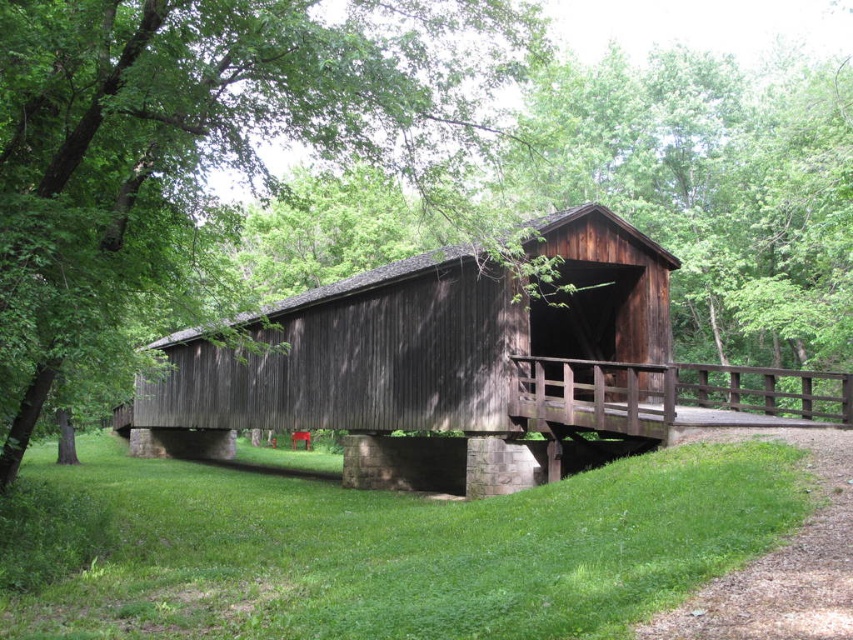
Question: Does green wood tree at center have a lesser width compared to green grass at lower right?

Choices:
 (A) yes
 (B) no

Answer: (B)

Question: Which point is closer to the camera?

Choices:
 (A) dark brown wooden bridge at center
 (B) green wood tree at center

Answer: (B)

Question: Can you confirm if green wood tree at center is wider than green grass at lower right?

Choices:
 (A) no
 (B) yes

Answer: (B)

Question: Does dark brown wooden bridge at center have a greater width compared to green grass at lower right?

Choices:
 (A) no
 (B) yes

Answer: (B)

Question: Among these points, which one is nearest to the camera?

Choices:
 (A) (350, 42)
 (B) (254, 376)
 (C) (808, 618)

Answer: (C)

Question: Which of the following is the closest to the observer?

Choices:
 (A) (763, 589)
 (B) (80, 84)
 (C) (515, 336)

Answer: (A)